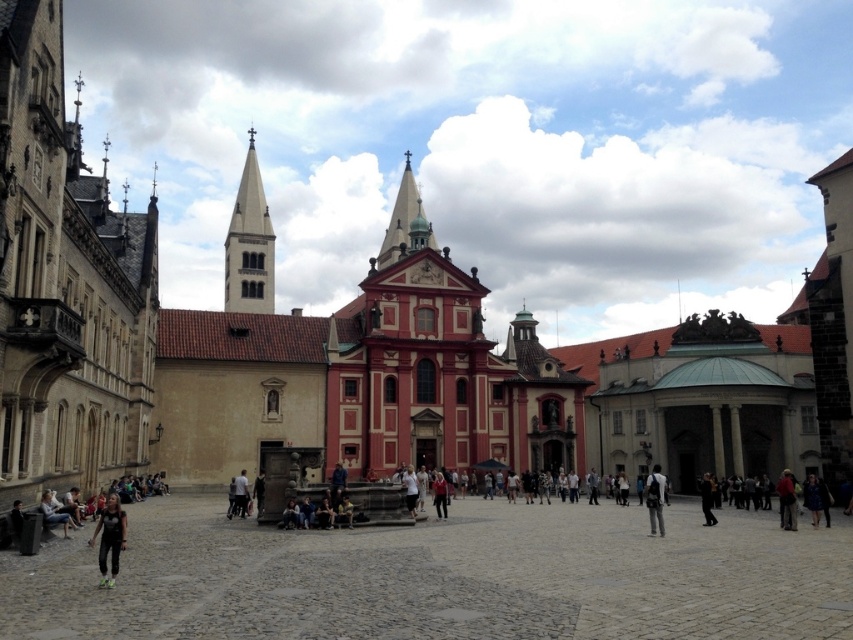
Who is positioned more to the right, black athletic wear at lower left or dark gray fabric pants at center?

From the viewer's perspective, dark gray fabric pants at center appears more on the right side.

Is point (119, 504) behind point (239, 513)?

No, it is not.

You are a GUI agent. You are given a task and a screenshot of the screen. Output one action in this format:
    pyautogui.click(x=<x>, y=<y>)
    Task: Click on the black athletic wear at lower left
    This screenshot has height=640, width=853.
    Given the screenshot: What is the action you would take?
    pyautogui.click(x=109, y=538)

Can you confirm if matte pink building at center is positioned above black leather jacket at center?

Yes.

Is point (407, 326) positioned after point (706, 497)?

Yes.

Is point (497, 372) positioned before point (706, 492)?

No, (497, 372) is further to viewer.

This screenshot has height=640, width=853. I want to click on matte pink building at center, so (440, 369).

Does gray stone tower at center have a smaller size compared to black leather jacket at center?

Incorrect, gray stone tower at center is not smaller in size than black leather jacket at center.

Can you confirm if gray stone tower at center is taller than black leather jacket at center?

Yes, gray stone tower at center is taller than black leather jacket at center.

Which is in front, point (251, 140) or point (704, 500)?

Point (704, 500)

At what (x,y) coordinates should I click in order to perform the action: click on gray stone tower at center. Please return your answer as a coordinate pair (x, y). Image resolution: width=853 pixels, height=640 pixels. Looking at the image, I should click on (248, 244).